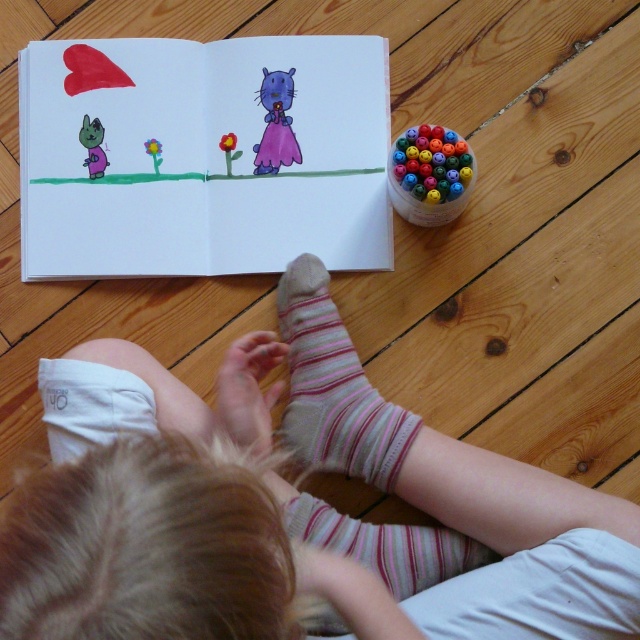
Question: Can you confirm if striped cotton socks at lower center is positioned below smooth red flower at center?

Choices:
 (A) yes
 (B) no

Answer: (A)

Question: Observing the image, what is the correct spatial positioning of multicolored plastic crayons at upper right in reference to smooth red flower at center?

Choices:
 (A) below
 (B) above

Answer: (A)

Question: Is purple matte dress at upper center further to camera compared to matte purple cat at left?

Choices:
 (A) yes
 (B) no

Answer: (A)

Question: Among these objects, which one is nearest to the camera?

Choices:
 (A) striped cotton sock at lower center
 (B) striped cotton socks at lower center
 (C) purple matte dress at upper center

Answer: (B)

Question: Which object appears farthest from the camera in this image?

Choices:
 (A) yellow paper flower at upper center
 (B) multicolored plastic crayons at upper right
 (C) purple matte dress at upper center

Answer: (C)

Question: Which point appears farthest from the camera in this image?

Choices:
 (A) (221, 134)
 (B) (429, 172)
 (C) (83, 534)

Answer: (A)